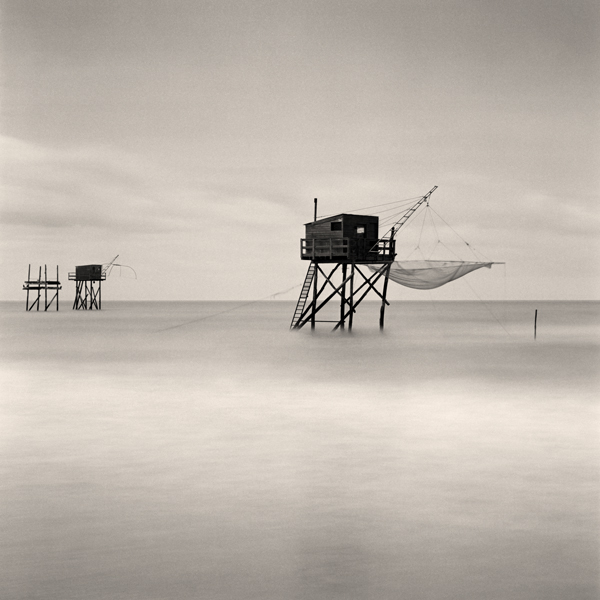
Locate an element on the screen. The image size is (600, 600). canvas is located at coordinates (438, 276).